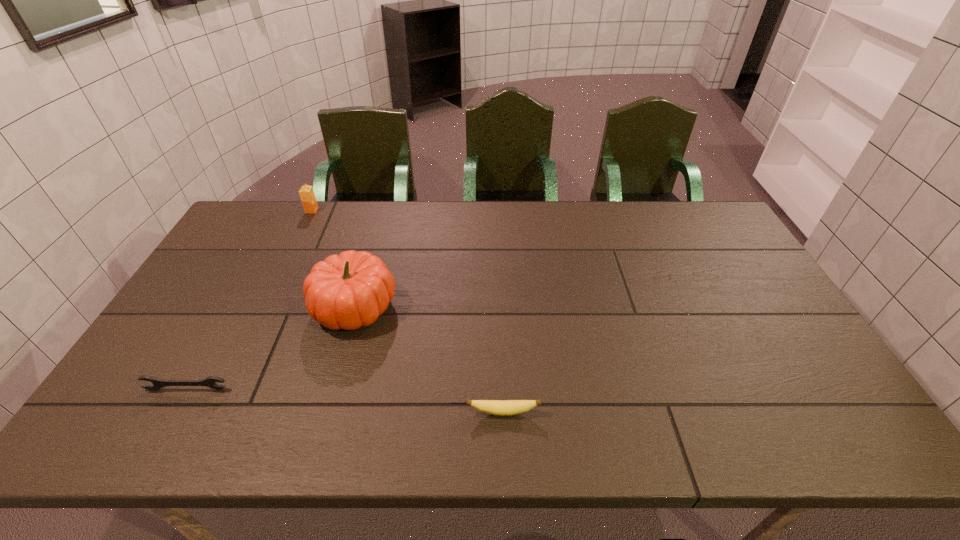
The height and width of the screenshot is (540, 960). I want to click on the second farthest object, so click(x=346, y=291).

Locate an element on the screen. This screenshot has height=540, width=960. pumpkin is located at coordinates (346, 291).

The width and height of the screenshot is (960, 540). I want to click on the second tallest object, so [x=306, y=193].

Find the location of a particular element. The image size is (960, 540). orange juice is located at coordinates (306, 193).

At what (x,y) coordinates should I click in order to perform the action: click on wrench. Please return your answer as a coordinate pair (x, y). Looking at the image, I should click on (x=210, y=381).

The height and width of the screenshot is (540, 960). I want to click on banana, so click(495, 407).

The width and height of the screenshot is (960, 540). Identify the location of the rightmost object. (495, 407).

You are a GUI agent. You are given a task and a screenshot of the screen. Output one action in this format:
    pyautogui.click(x=<x>, y=<y>)
    Task: Click on the vacant area situated on the left of the third object from left to right
    The height and width of the screenshot is (540, 960).
    Given the screenshot: What is the action you would take?
    pyautogui.click(x=282, y=306)

The width and height of the screenshot is (960, 540). In order to click on free space located on the right of the orange juice in this screenshot , I will do `click(345, 211)`.

I want to click on vacant space located on the open ends of the wrench, so (164, 429).